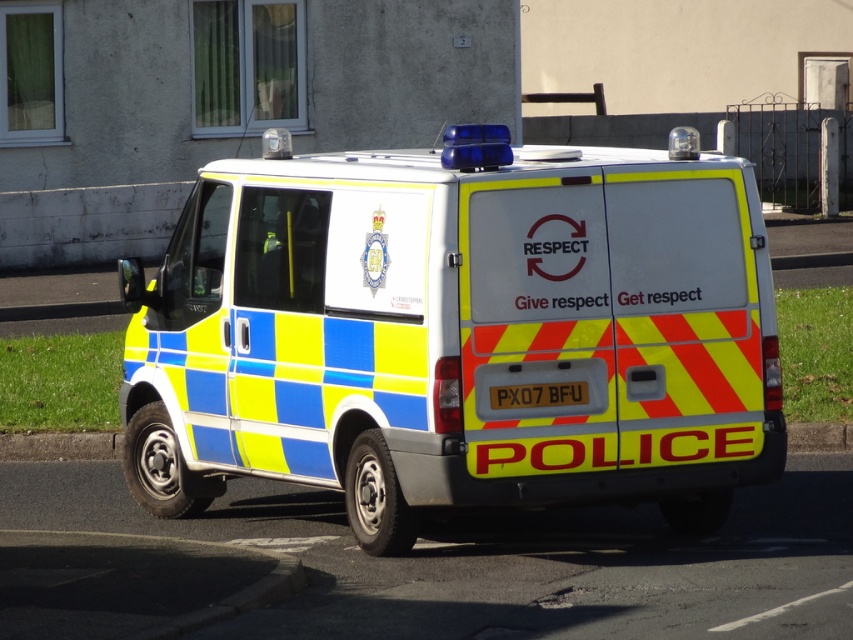
You are a delivery driver who needs to park your truck near the curb. There is a yellow and blue checkered police van at center and a yellow reflective plate at center in the area. According to traffic regulations, vehicles must maintain a minimum distance of 36 inches from any reflective plates to avoid blocking emergency access. Can you park your truck in this spot?

The yellow and blue checkered police van at center is only 35.64 inches away from the yellow reflective plate at center, which is less than the required 36 inches. Therefore, you cannot park your truck here as it would violate the traffic regulation regarding the minimum distance from reflective plates.

You are a delivery driver who needs to park your truck next to the curb behind the yellow and blue checkered police van at center and the yellow reflective plate at center. Can you park your truck there if your truck is 10 meters long?

The yellow and blue checkered police van at center is larger than the yellow reflective plate at center, but the description does not provide the exact distance between them or the available space behind the van. Without knowing the available space, it is impossible to determine if the truck can fit.

You are a pedestrian standing on the sidewalk. You see the yellow and blue checkered police van at center and the yellow reflective plate at center. Which object is closer to you?

The yellow and blue checkered police van at center is closer to you because it is in front of the yellow reflective plate at center.